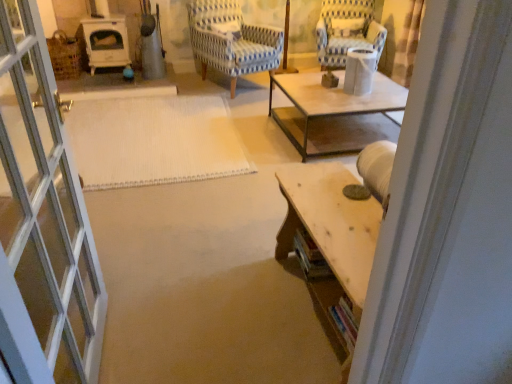
Question: Could you tell me if white woven mat at center is turned towards wooden table at lower right?

Choices:
 (A) no
 (B) yes

Answer: (A)

Question: Does white woven mat at center lie behind wooden table at lower right?

Choices:
 (A) no
 (B) yes

Answer: (B)

Question: Does white woven mat at center have a greater height compared to wooden table at lower right?

Choices:
 (A) no
 (B) yes

Answer: (A)

Question: Does white woven mat at center lie in front of wooden table at lower right?

Choices:
 (A) yes
 (B) no

Answer: (B)

Question: Does white woven mat at center have a lesser width compared to wooden table at lower right?

Choices:
 (A) yes
 (B) no

Answer: (B)

Question: Is white woven mat at center far from wooden table at lower right?

Choices:
 (A) yes
 (B) no

Answer: (A)

Question: Is wooden table at lower right next to blue striped fabric chair at center, acting as the 2th chair starting from the right?

Choices:
 (A) no
 (B) yes

Answer: (A)

Question: Is wooden table at lower right turned away from blue striped fabric chair at center, which ranks as the first chair in left-to-right order?

Choices:
 (A) yes
 (B) no

Answer: (B)

Question: Is blue striped fabric chair at center, which ranks as the first chair in left-to-right order, a part of wooden table at lower right?

Choices:
 (A) yes
 (B) no

Answer: (B)

Question: Could you tell me if wooden table at lower right is turned towards blue striped fabric chair at center, which ranks as the first chair in left-to-right order?

Choices:
 (A) yes
 (B) no

Answer: (B)

Question: Considering the relative sizes of wooden table at lower right and blue striped fabric chair at center, which ranks as the first chair in left-to-right order, in the image provided, is wooden table at lower right taller than blue striped fabric chair at center, which ranks as the first chair in left-to-right order,?

Choices:
 (A) yes
 (B) no

Answer: (B)

Question: Is wooden table at lower right further to camera compared to blue striped fabric chair at center, acting as the 2th chair starting from the right?

Choices:
 (A) yes
 (B) no

Answer: (B)

Question: Does blue and white striped fabric chair at upper right, the 2th chair when ordered from left to right, have a larger size compared to wooden table at lower right?

Choices:
 (A) yes
 (B) no

Answer: (A)